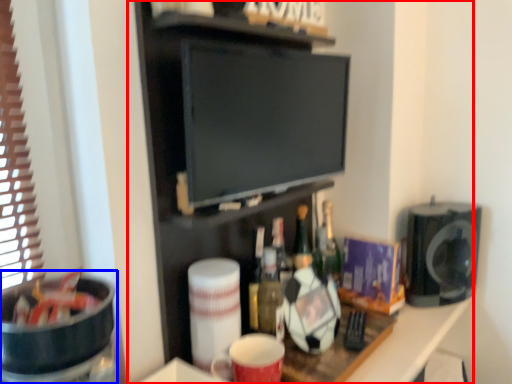
Question: Among these objects, which one is nearest to the camera, entertainment center (highlighted by a red box) or appliance (highlighted by a blue box)?

Choices:
 (A) entertainment center
 (B) appliance

Answer: (B)